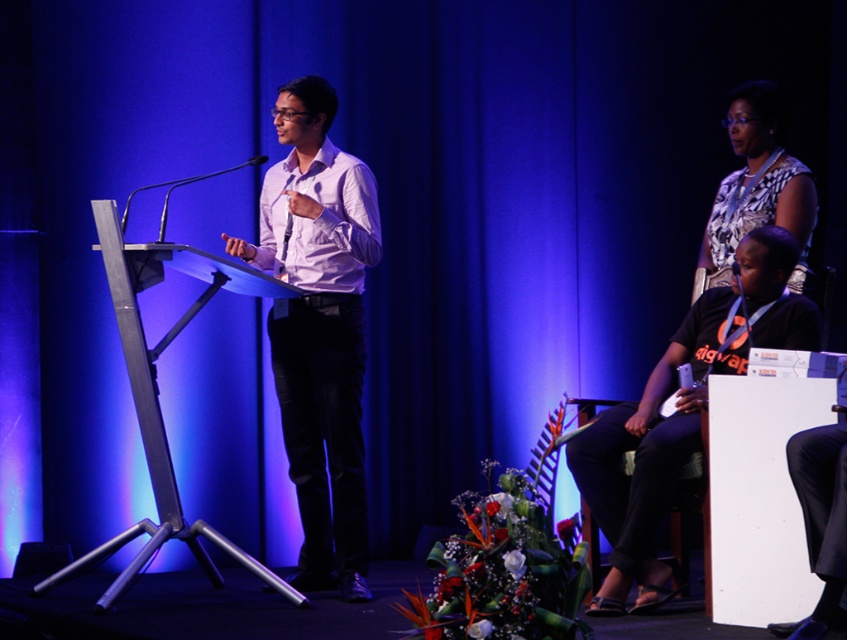
Who is more forward, (773, 332) or (767, 116)?

Point (773, 332)

The image size is (847, 640). I want to click on black matte shirt at center, so click(x=651, y=451).

Between point (325, 232) and point (574, 476), which one is positioned behind?

The point (325, 232) is behind.

Describe the element at coordinates (319, 328) in the screenshot. I see `white glossy shirt at center` at that location.

Which is behind, point (347, 547) or point (671, 387)?

The point (347, 547) is behind.

At what (x,y) coordinates should I click in order to perform the action: click on white glossy shirt at center. Please return your answer as a coordinate pair (x, y). This screenshot has height=640, width=847. Looking at the image, I should click on (319, 328).

Does point (353, 580) come closer to viewer compared to point (790, 228)?

No.

Between point (295, 362) and point (739, 116), which one is positioned behind?

The point (739, 116) is behind.

This screenshot has height=640, width=847. Identify the location of white glossy shirt at center. (319, 328).